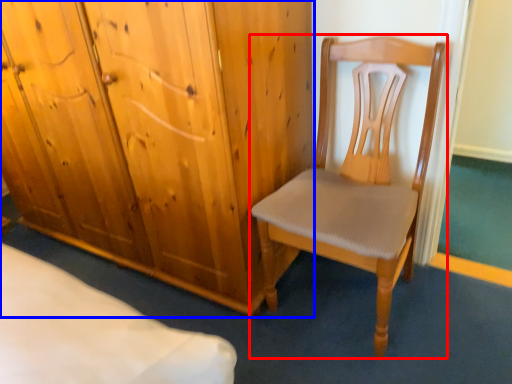
Question: Among these objects, which one is nearest to the camera, chair (highlighted by a red box) or cupboard (highlighted by a blue box)?

Choices:
 (A) chair
 (B) cupboard

Answer: (A)